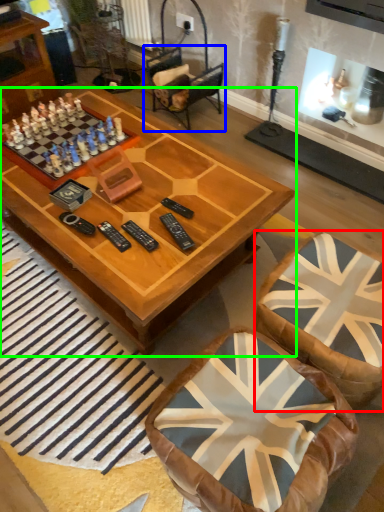
Question: Estimate the real-world distances between objects in this image. Which object is farther from swivel chair (highlighted by a red box), armchair (highlighted by a blue box) or coffee table (highlighted by a green box)?

Choices:
 (A) armchair
 (B) coffee table

Answer: (A)